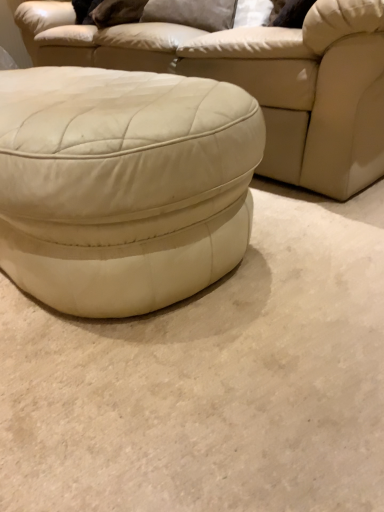
Where is `blank space situated above white leather ottoman at center (from a real-world perspective)`? This screenshot has width=384, height=512. blank space situated above white leather ottoman at center (from a real-world perspective) is located at coordinates [261, 298].